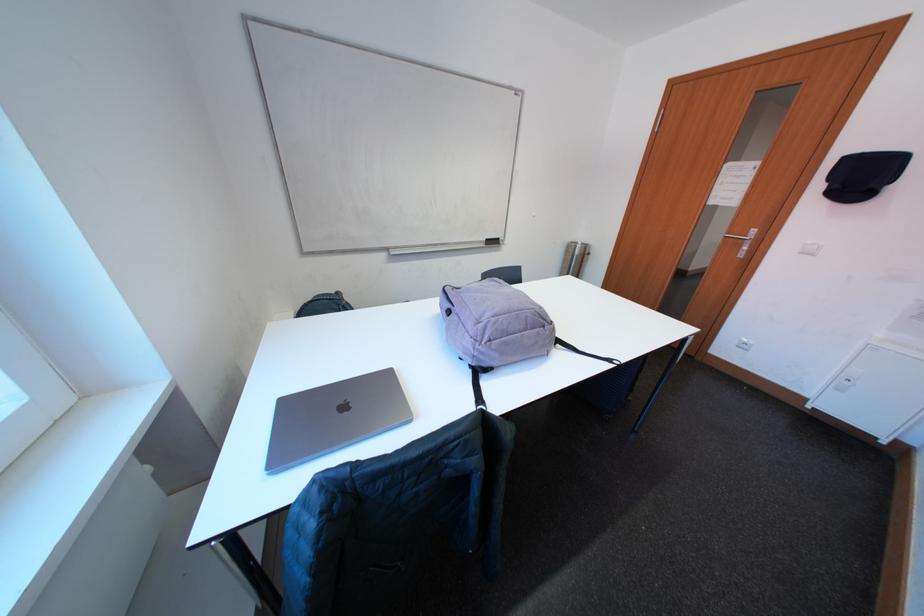
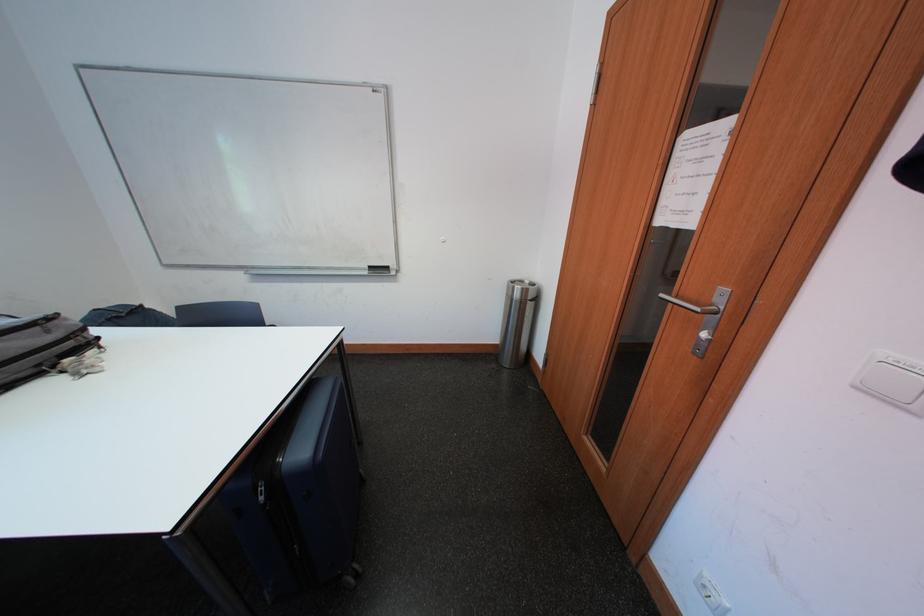
In a continuous first-person perspective shot, in which direction is the camera moving?

The cameraman walked toward right, forward.